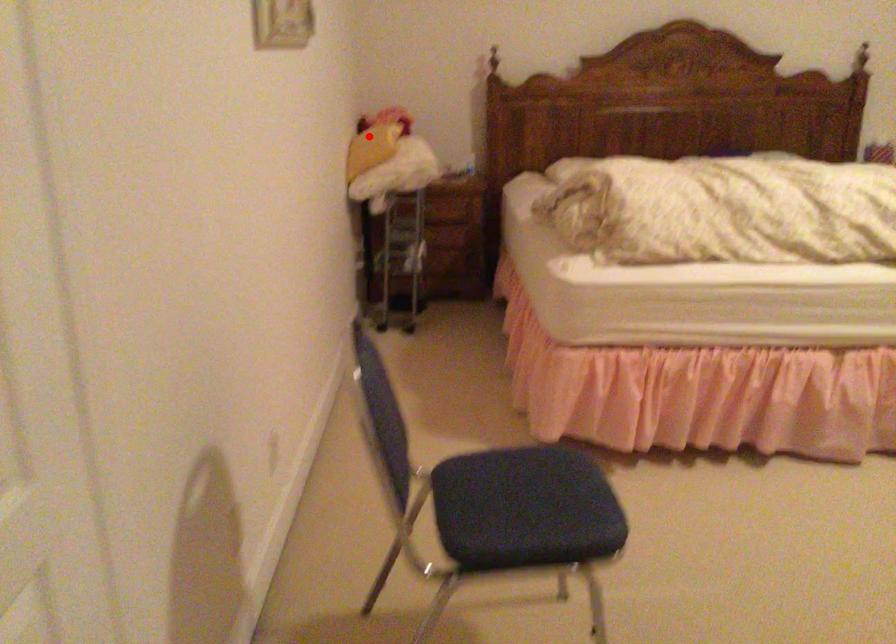
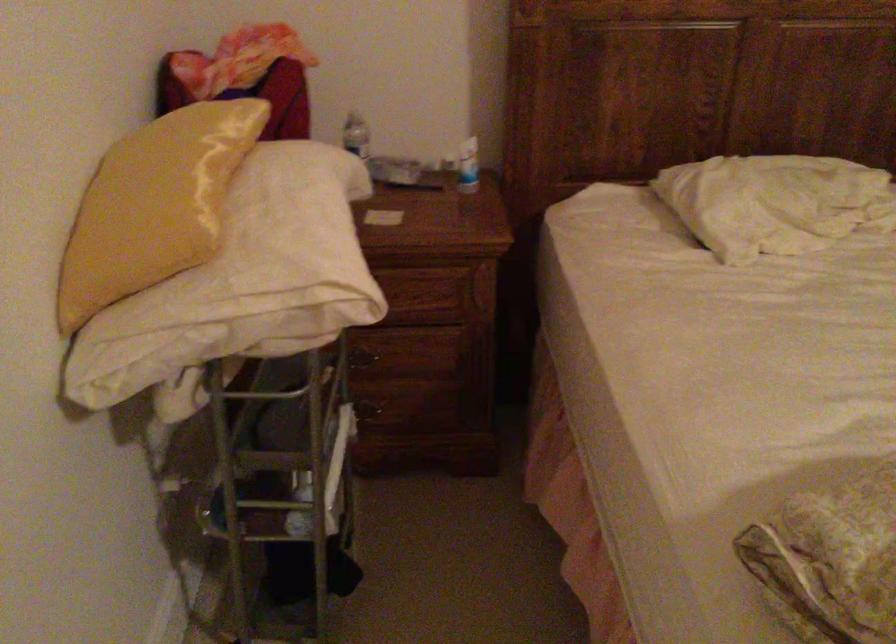
Question: I am providing you with two images of the same scene from different viewpoints. A red point is shown in image1. For the corresponding object point in image2, is it positioned nearer or farther from the camera?

Choices:
 (A) Nearer
 (B) Farther

Answer: (A)